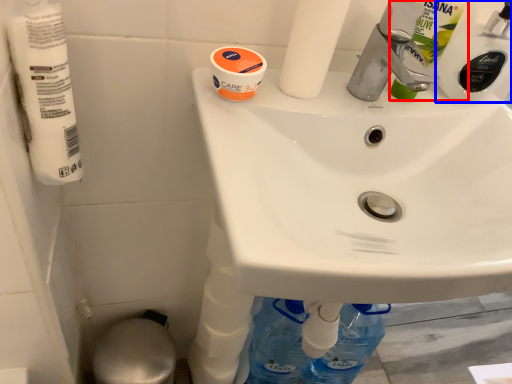
Question: Among these objects, which one is nearest to the camera, cleaning product (highlighted by a red box) or cleaning product (highlighted by a blue box)?

Choices:
 (A) cleaning product
 (B) cleaning product

Answer: (A)